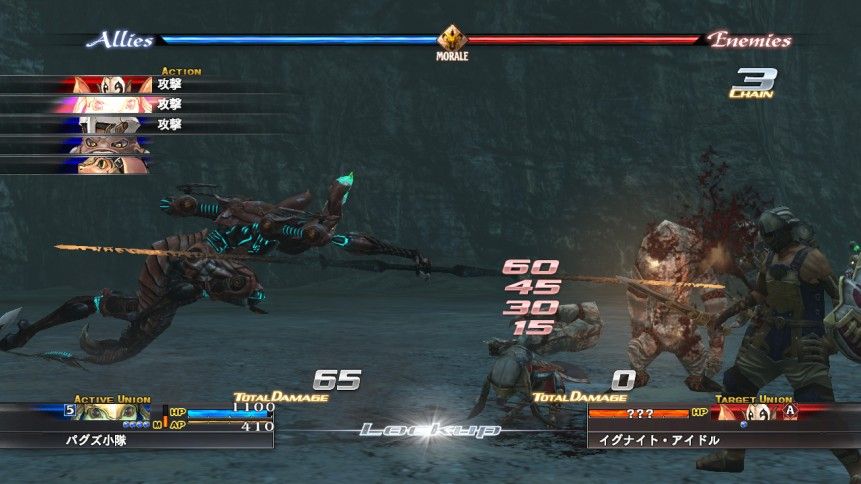
Where is `floor`? The image size is (861, 484). floor is located at coordinates (437, 354).